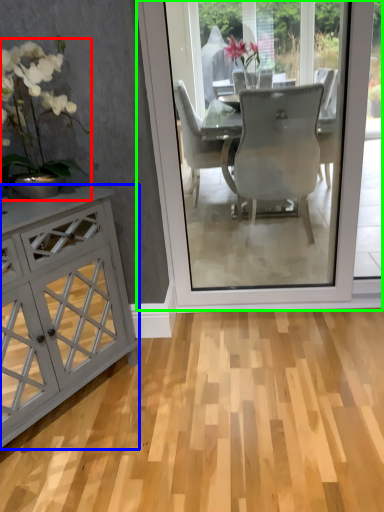
Question: Considering the real-world distances, which object is closest to houseplant (highlighted by a red box)? cabinetry (highlighted by a blue box) or screen door (highlighted by a green box).

Choices:
 (A) cabinetry
 (B) screen door

Answer: (A)